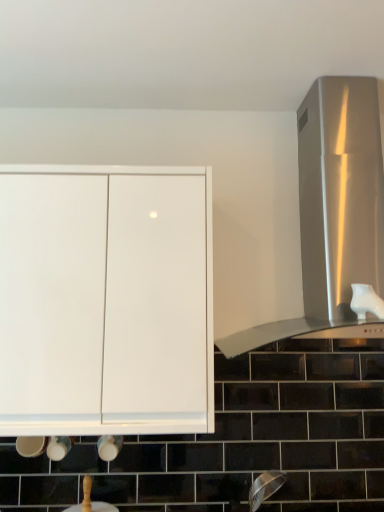
The image size is (384, 512). In order to click on empty space that is ontop of stainless steel vent at right (from a real-world perspective) in this screenshot , I will do click(292, 81).